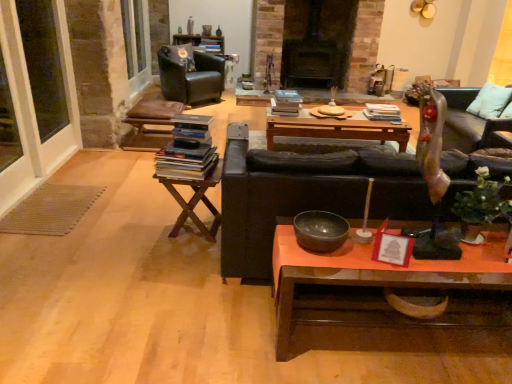
Question: Would you say woodenwoodentable at left is inside or outside matte red picture frame at center?

Choices:
 (A) outside
 (B) inside

Answer: (A)

Question: From the image's perspective, is woodenwoodentable at left positioned above or below matte red picture frame at center?

Choices:
 (A) below
 (B) above

Answer: (B)

Question: Based on their relative distances, which object is nearer to the matte red picture frame at center?

Choices:
 (A) wooden polished coffee table at lower center, marked as the second coffee table in a back-to-front arrangement
 (B) wooden polished coffee table at center, acting as the 2th coffee table starting from the front
 (C) hardcover book at center, which is the 1th book in back-to-front order
 (D) metallic silver couch at right
 (E) black leather armchair at upper left

Answer: (A)

Question: Considering the real-world distances, which object is farthest from the black leather couch at center?

Choices:
 (A) black leather armchair at upper left
 (B) hardcover book at center, which is the second book from bottom to top
 (C) hardcover books at center left, which is counted as the 3th book, starting from the back
 (D) metallic silver couch at right
 (E) hardcover books at center, the second book viewed from the front

Answer: (A)